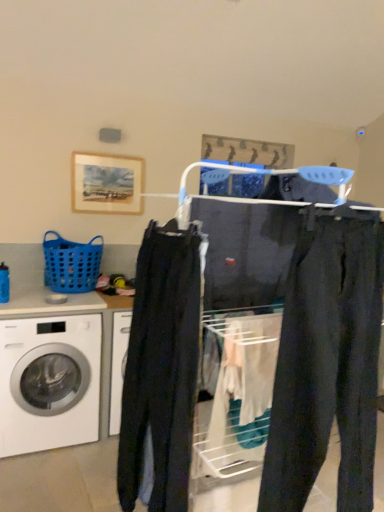
What do you see at coordinates (264, 342) in the screenshot?
I see `dark blue jeans at center` at bounding box center [264, 342].

Describe the element at coordinates (107, 183) in the screenshot. I see `wooden frame at upper left` at that location.

The image size is (384, 512). What do you see at coordinates (327, 362) in the screenshot?
I see `dark gray cotton pants at center` at bounding box center [327, 362].

Measure the distance between blue plastic basket at left and camera.

They are 2.83 meters apart.

Identify the location of dark blue jeans at center. The image size is (384, 512). (264, 342).

From the image's perspective, which is below, blue plastic basket at left or dark blue jeans at center?

From the image's view, dark blue jeans at center is below.

Between blue plastic basket at left and dark blue jeans at center, which one has smaller width?

dark blue jeans at center is thinner.

Which is more to the left, blue plastic basket at left or dark blue jeans at center?

From the viewer's perspective, blue plastic basket at left appears more on the left side.

From a real-world perspective, is dark blue jeans at center below dark blue jeans at center?

Actually, dark blue jeans at center is physically above dark blue jeans at center in the real world.

Are dark blue jeans at center and dark blue jeans at center beside each other?

dark blue jeans at center is not next to dark blue jeans at center, and they're not touching.

Could you tell me if dark blue jeans at center is turned towards dark blue jeans at center?

Yes, dark blue jeans at center is oriented towards dark blue jeans at center.

Considering the relative positions of dark blue jeans at center and dark blue jeans at center in the image provided, is dark blue jeans at center in front of dark blue jeans at center?

No.

Looking at this image, considering the relative positions of wooden frame at upper left and dark gray cotton pants at center in the image provided, is wooden frame at upper left behind dark gray cotton pants at center?

Yes, it is.

Considering the relative sizes of wooden frame at upper left and dark gray cotton pants at center in the image provided, is wooden frame at upper left smaller than dark gray cotton pants at center?

Indeed, wooden frame at upper left has a smaller size compared to dark gray cotton pants at center.

Are wooden frame at upper left and dark gray cotton pants at center making contact?

No, wooden frame at upper left is not next to dark gray cotton pants at center.

Is point (353, 358) closer to camera compared to point (110, 189)?

Yes, it is in front of point (110, 189).

Would you say dark gray cotton pants at center is a long distance from wooden frame at upper left?

Yes, dark gray cotton pants at center and wooden frame at upper left are quite far apart.

Which of these two, dark gray cotton pants at center or wooden frame at upper left, stands shorter?

Standing shorter between the two is wooden frame at upper left.

Looking at this image, how many degrees apart are the facing directions of dark gray cotton pants at center and wooden frame at upper left?

There is a 8.86-degree angle between the facing directions of dark gray cotton pants at center and wooden frame at upper left.

Where is `clothing located above the white glossy washing machine at lower left (from the image's perspective)`? This screenshot has width=384, height=512. clothing located above the white glossy washing machine at lower left (from the image's perspective) is located at coordinates (161, 372).

Relative to white glossy washing machine at lower left, is dark blue jeans at center in front or behind?

Visually, dark blue jeans at center is located in front of white glossy washing machine at lower left.

Is dark blue jeans at center facing away from white glossy washing machine at lower left?

dark blue jeans at center is not turned away from white glossy washing machine at lower left.

Considering the positions of objects dark blue jeans at center and white glossy washing machine at lower left in the image provided, who is more to the right, dark blue jeans at center or white glossy washing machine at lower left?

dark blue jeans at center.

Would you say wooden frame at upper left is to the left or to the right of dark blue jeans at center in the picture?

From the image, it's evident that wooden frame at upper left is to the left of dark blue jeans at center.

Which is correct: wooden frame at upper left is inside dark blue jeans at center, or outside of it?

wooden frame at upper left is not inside dark blue jeans at center, it's outside.

From a real-world perspective, who is located higher, wooden frame at upper left or dark blue jeans at center?

From a 3D spatial view, wooden frame at upper left is above.

Considering the relative positions of wooden frame at upper left and blue plastic basket at left in the image provided, is wooden frame at upper left to the left of blue plastic basket at left from the viewer's perspective?

No.

From the image's perspective, is wooden frame at upper left above blue plastic basket at left?

Correct, wooden frame at upper left appears higher than blue plastic basket at left in the image.

Can you tell me how much wooden frame at upper left and blue plastic basket at left differ in facing direction?

0.112 degrees.

You are a GUI agent. You are given a task and a screenshot of the screen. Output one action in this format:
    pyautogui.click(x=<x>, y=<y>)
    Task: Click on the picture frame that appears on the right of blue plastic basket at left
    The height and width of the screenshot is (512, 384).
    Given the screenshot: What is the action you would take?
    pyautogui.click(x=107, y=183)

The height and width of the screenshot is (512, 384). I want to click on basket that appears on the left of dark blue jeans at center, so click(71, 264).

The height and width of the screenshot is (512, 384). Identify the location of clothing that is above the dark blue jeans at center (from the image's perspective). (161, 372).

From the image, which object appears to be nearer to dark blue jeans at center, white glossy washing machine at lower left or wooden frame at upper left?

white glossy washing machine at lower left is closer to dark blue jeans at center.

Looking at the image, which one is located closer to dark gray cotton pants at center, dark blue jeans at center or blue plastic basket at left?

dark blue jeans at center.

Considering their positions, is dark blue jeans at center positioned closer to wooden frame at upper left than blue plastic basket at left?

The object closer to wooden frame at upper left is blue plastic basket at left.

Based on their spatial positions, is white glossy washing machine at lower left or dark blue jeans at center closer to dark blue jeans at center?

The object closer to dark blue jeans at center is dark blue jeans at center.

Consider the image. Based on their spatial positions, is dark blue jeans at center or blue plastic basket at left further from white glossy washing machine at lower left?

Among the two, dark blue jeans at center is located further to white glossy washing machine at lower left.

Which object lies further to the anchor point blue plastic basket at left, dark gray cotton pants at center or dark blue jeans at center?

dark gray cotton pants at center is further to blue plastic basket at left.

Based on their spatial positions, is blue plastic basket at left or dark gray cotton pants at center further from wooden frame at upper left?

Among the two, dark gray cotton pants at center is located further to wooden frame at upper left.

Based on their spatial positions, is dark blue jeans at center or white glossy washing machine at lower left closer to blue plastic basket at left?

The object closer to blue plastic basket at left is white glossy washing machine at lower left.

In order to click on pants between dark blue jeans at center and white glossy washing machine at lower left in the front-back direction in this screenshot , I will do `click(327, 362)`.

At what (x,y) coordinates should I click in order to perform the action: click on basket between dark gray cotton pants at center and wooden frame at upper left in the front-back direction. Please return your answer as a coordinate pair (x, y). Looking at the image, I should click on (71, 264).

Locate an element on the screen. Image resolution: width=384 pixels, height=512 pixels. clothing between dark blue jeans at center and blue plastic basket at left in the front-back direction is located at coordinates (161, 372).

In order to click on clothing between dark gray cotton pants at center and blue plastic basket at left in the front-back direction in this screenshot , I will do `click(161, 372)`.